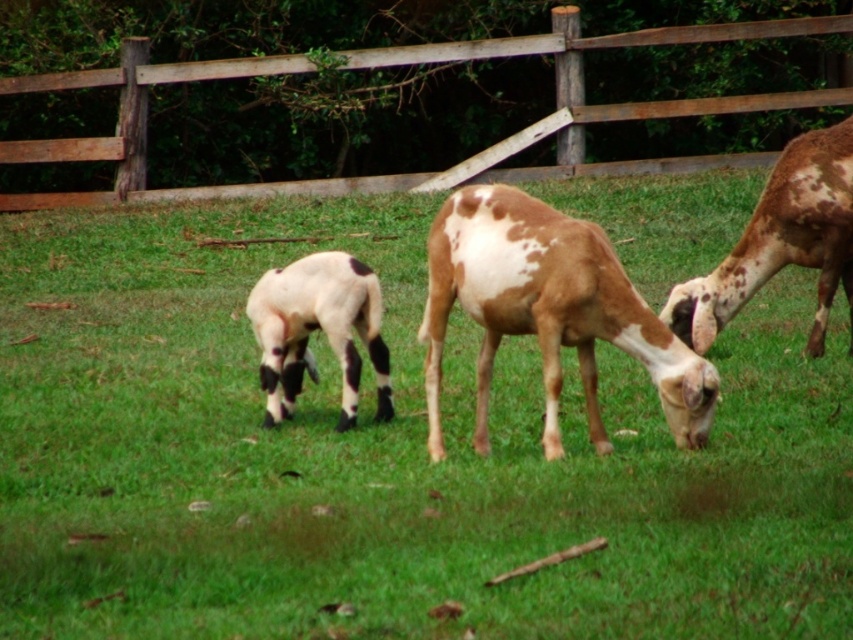
You are standing in the field and want to walk towards the speckled fur goat at center. Which direction should you move relative to the brown wooden fence at upper center?

To reach the speckled fur goat at center, you should move to the right of the brown wooden fence at upper center since the fence is located to its left.

You are standing at the point with coordinates (399, 65) in a field with three grazing goats. What object is located exactly at your current position?

The brown wooden fence at upper center is located exactly at point (399, 65).